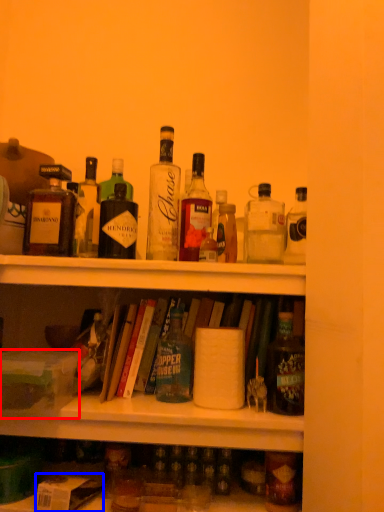
Question: Among these objects, which one is farthest to the camera, box (highlighted by a red box) or box (highlighted by a blue box)?

Choices:
 (A) box
 (B) box

Answer: (A)